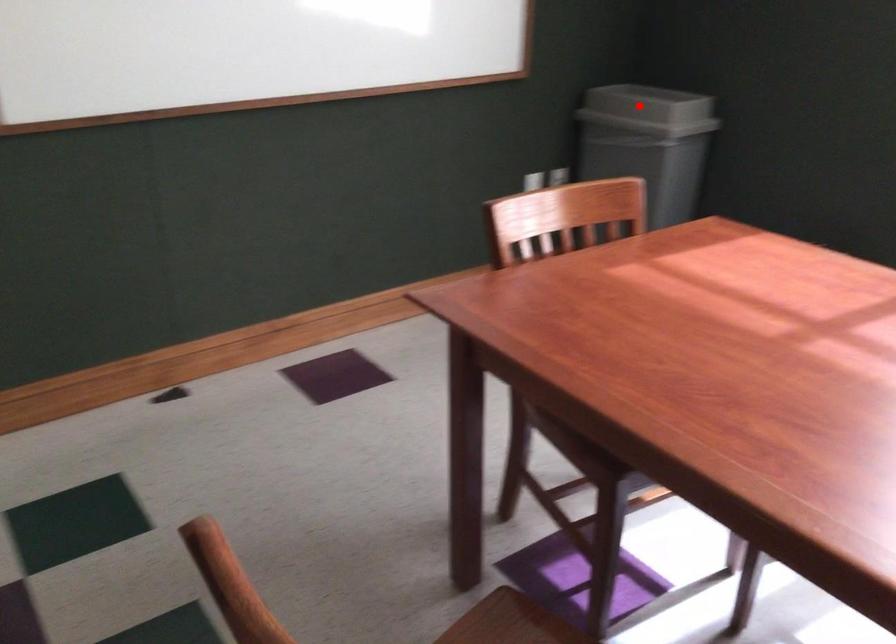
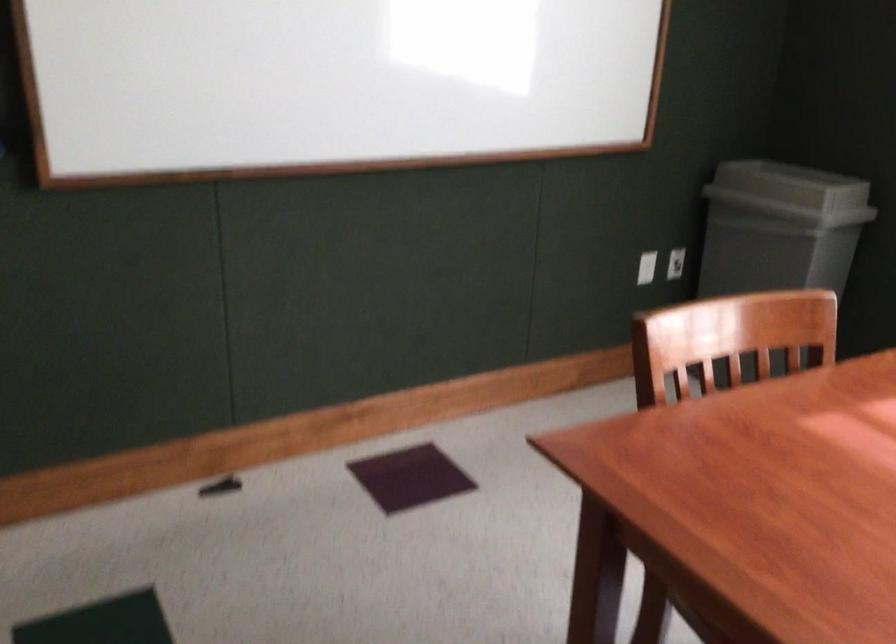
Question: A red point is marked in image1. In image2, is the corresponding 3D point closer to the camera or farther? Reply with the corresponding letter.

Choices:
 (A) The corresponding 3D point is closer.
 (B) The corresponding 3D point is farther.

Answer: (A)